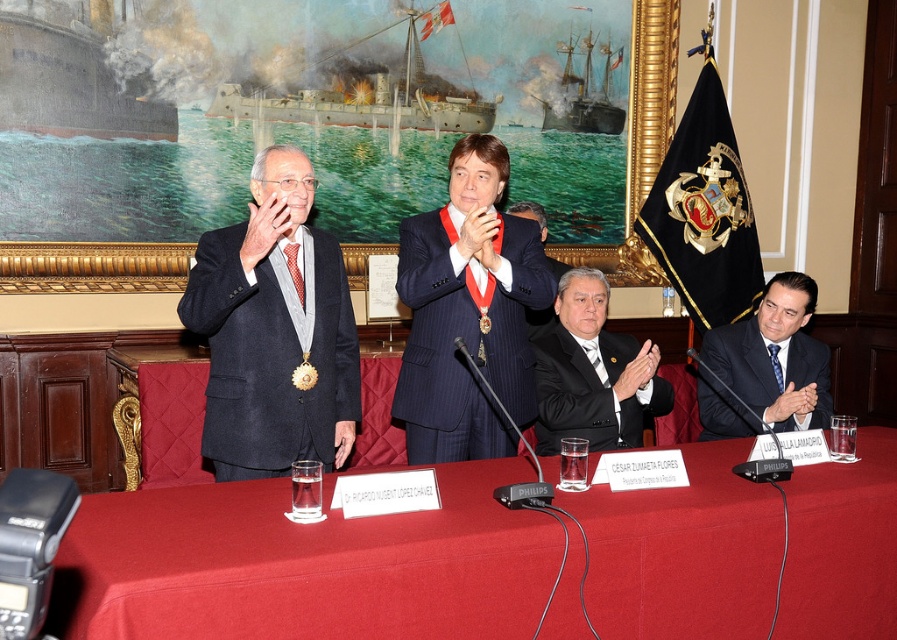
You are a photographer at the event and need to capture a clear photo of both the black satin suit at center and the black suit at center. Since they are overlapping, which one should you focus on to ensure the other is still visible in the background?

The black satin suit at center is positioned over black suit at center, so focusing on the front one, the black satin suit at center, will keep the black suit at center visible behind it.

You are a photographer at this event and need to ensure both the smooth red tablecloth at center and the black satin suit at center are visible in your photo. Given their heights, which one might you need to adjust your camera angle for to capture both properly?

The smooth red tablecloth at center has a lesser height compared to the black satin suit at center. To capture both, you might need to lower your camera angle slightly to ensure the tablecloth is visible while still framing the suit appropriately.

You are a photographer positioned to the left of the scene. You need to capture a clear shot of both the black suit at center and the black plastic microphone at lower right. Which object will appear larger in your photo?

The black suit at center will appear larger in the photo because it is taller than the black plastic microphone at lower right.